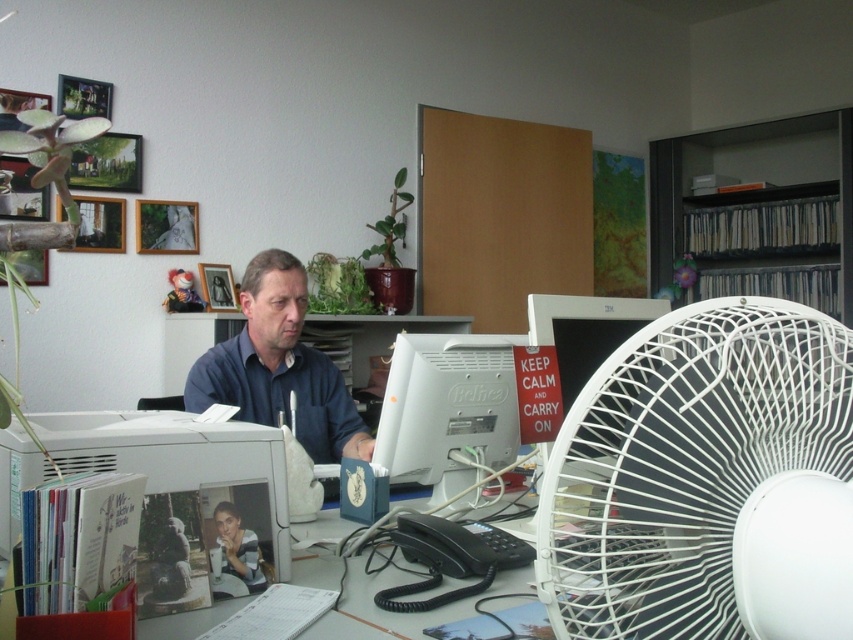
You are a delivery person entering the office and need to place a 24 inch box on the desk. The desk has a white plastic fan at right. Can you fit the box on the desk without moving the fan?

The white plastic fan at right is 23.65 inches away from the viewer, so the 24 inch box would not fit on the desk without moving the fan since it is slightly longer than the available space.

You are organizing a desk and need to place a new item between the white plastic fan at right and the dark blue shirt at center. Which object should you place the item closer to if the item requires more space due to its thickness?

The item requiring more thickness should be placed closer to the dark blue shirt at center since the white plastic fan at right is thinner than the dark blue shirt at center, meaning the shirt occupies more space in that dimension.

You are standing in front of the desk and want to hand a document to the person wearing the dark blue shirt at center. The document needs to be placed on the white glossy monitor at center right. Can you reach the monitor from your current position without moving around the desk?

The dark blue shirt at center is further to the viewer than the white glossy monitor at center right, so the monitor is closer to you. You can reach the white glossy monitor at center right easily from your current position.